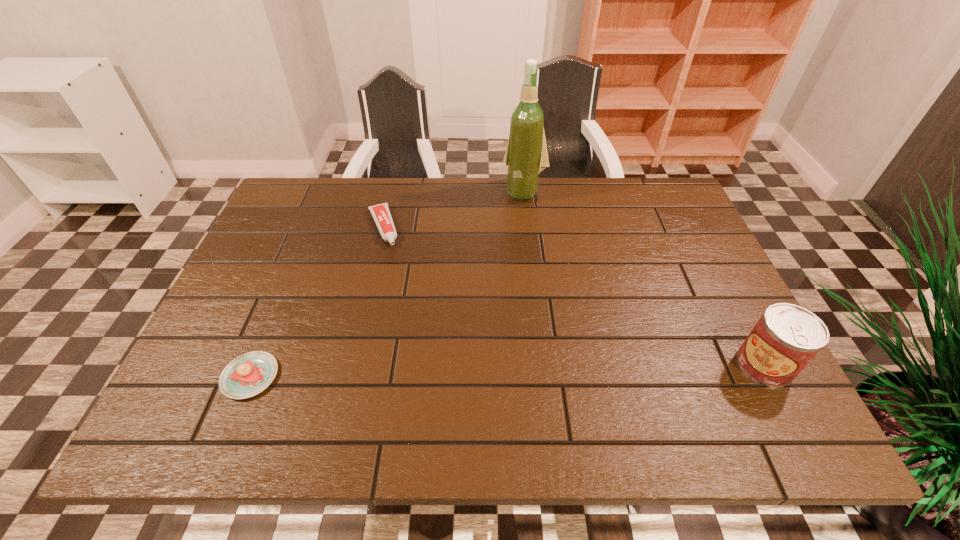
The width and height of the screenshot is (960, 540). I want to click on free space on the desktop that is between the leftmost object and the can and is positioned at the nozzle of the toothpaste, so click(438, 372).

At what (x,y) coordinates should I click in order to perform the action: click on free space on the desktop that is between the leftmost object and the second tallest object and is positioned on the front-facing side of the tallest object. Please return your answer as a coordinate pair (x, y). The image size is (960, 540). Looking at the image, I should click on (434, 372).